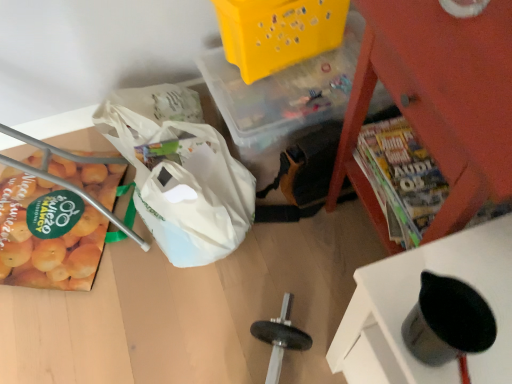
The height and width of the screenshot is (384, 512). Describe the element at coordinates (45, 239) in the screenshot. I see `yellow matte oranges at left` at that location.

Find the location of a particular element. The image size is (512, 384). silver metallic cup at lower right, arranged as the 1th furniture when viewed from the front is located at coordinates (416, 301).

Identify the location of yellow plastic basket at upper center. The width and height of the screenshot is (512, 384). (278, 32).

Find the location of `metallic red magazine rack at upper right, the second furniture positioned from the front`. metallic red magazine rack at upper right, the second furniture positioned from the front is located at coordinates (437, 102).

Who is more distant, silver metallic cup at lower right, arranged as the 1th furniture when viewed from the front, or yellow matte oranges at left?

yellow matte oranges at left is more distant.

From the image's perspective, is silver metallic cup at lower right, the second furniture viewed from the back, beneath yellow matte oranges at left?

Indeed, from the image's perspective, silver metallic cup at lower right, the second furniture viewed from the back, is shown beneath yellow matte oranges at left.

Does silver metallic cup at lower right, arranged as the 1th furniture when viewed from the front, appear on the right side of yellow matte oranges at left?

Indeed, silver metallic cup at lower right, arranged as the 1th furniture when viewed from the front, is positioned on the right side of yellow matte oranges at left.

Who is bigger, silver metallic cup at lower right, arranged as the 1th furniture when viewed from the front, or yellow matte oranges at left?

With larger size is yellow matte oranges at left.

Which of these two, silver metallic cup at lower right, the second furniture viewed from the back, or yellow plastic basket at upper center, is wider?

yellow plastic basket at upper center is wider.

Considering the sizes of silver metallic cup at lower right, the second furniture viewed from the back, and yellow plastic basket at upper center in the image, is silver metallic cup at lower right, the second furniture viewed from the back, bigger or smaller than yellow plastic basket at upper center?

In the image, silver metallic cup at lower right, the second furniture viewed from the back, appears to be smaller than yellow plastic basket at upper center.

From a real-world perspective, who is located lower, silver metallic cup at lower right, arranged as the 1th furniture when viewed from the front, or yellow plastic basket at upper center?

yellow plastic basket at upper center, from a real-world perspective.

Considering the positions of objects silver metallic cup at lower right, arranged as the 1th furniture when viewed from the front, and yellow plastic basket at upper center in the image provided, who is more to the left, silver metallic cup at lower right, arranged as the 1th furniture when viewed from the front, or yellow plastic basket at upper center?

yellow plastic basket at upper center is more to the left.

Is metallic red magazine rack at upper right, arranged as the first furniture when viewed from the back, at the back of yellow matte oranges at left?

No, metallic red magazine rack at upper right, arranged as the first furniture when viewed from the back, is not at the back of yellow matte oranges at left.

Is yellow matte oranges at left positioned before metallic red magazine rack at upper right, arranged as the first furniture when viewed from the back?

No, it is behind metallic red magazine rack at upper right, arranged as the first furniture when viewed from the back.

Is metallic red magazine rack at upper right, arranged as the first furniture when viewed from the back, completely or partially inside yellow matte oranges at left?

That's incorrect, metallic red magazine rack at upper right, arranged as the first furniture when viewed from the back, is not inside yellow matte oranges at left.

From a real-world perspective, relative to metallic red magazine rack at upper right, the second furniture positioned from the front, is yellow matte oranges at left vertically above or below?

From a real-world perspective, yellow matte oranges at left is physically below metallic red magazine rack at upper right, the second furniture positioned from the front.

In the scene shown: Considering the relative sizes of yellow plastic basket at upper center and white plastic grocery bag at lower left in the image provided, is yellow plastic basket at upper center thinner than white plastic grocery bag at lower left?

Indeed, yellow plastic basket at upper center has a lesser width compared to white plastic grocery bag at lower left.

Is point (281, 19) farther from viewer compared to point (249, 192)?

No, (281, 19) is closer to viewer.

Are yellow plastic basket at upper center and white plastic grocery bag at lower left beside each other?

No, yellow plastic basket at upper center is not beside white plastic grocery bag at lower left.

Is white plastic grocery bag at lower left oriented away from metallic red magazine rack at upper right, arranged as the first furniture when viewed from the back?

Yes, white plastic grocery bag at lower left is positioned with its back facing metallic red magazine rack at upper right, arranged as the first furniture when viewed from the back.

Is white plastic grocery bag at lower left wider or thinner than metallic red magazine rack at upper right, arranged as the first furniture when viewed from the back?

In the image, white plastic grocery bag at lower left appears to be wider than metallic red magazine rack at upper right, arranged as the first furniture when viewed from the back.

Would you say white plastic grocery bag at lower left is inside or outside metallic red magazine rack at upper right, the second furniture positioned from the front?

white plastic grocery bag at lower left is located beyond the bounds of metallic red magazine rack at upper right, the second furniture positioned from the front.

Is white plastic grocery bag at lower left to the left of metallic red magazine rack at upper right, the second furniture positioned from the front, from the viewer's perspective?

Indeed, white plastic grocery bag at lower left is positioned on the left side of metallic red magazine rack at upper right, the second furniture positioned from the front.

Considering the sizes of objects white plastic grocery bag at lower left and yellow plastic basket at upper center in the image provided, who is bigger, white plastic grocery bag at lower left or yellow plastic basket at upper center?

Bigger between the two is white plastic grocery bag at lower left.

Is white plastic grocery bag at lower left wider than yellow plastic basket at upper center?

Indeed, white plastic grocery bag at lower left has a greater width compared to yellow plastic basket at upper center.

Is white plastic grocery bag at lower left not within yellow plastic basket at upper center?

Yes, white plastic grocery bag at lower left is outside of yellow plastic basket at upper center.

From the image's perspective, is white plastic grocery bag at lower left below yellow plastic basket at upper center?

Correct, white plastic grocery bag at lower left appears lower than yellow plastic basket at upper center in the image.

From a real-world perspective, is metallic red magazine rack at upper right, the second furniture positioned from the front, physically below white plastic grocery bag at lower left?

No, from a real-world perspective, metallic red magazine rack at upper right, the second furniture positioned from the front, is not under white plastic grocery bag at lower left.

From the image's perspective, which one is positioned higher, metallic red magazine rack at upper right, the second furniture positioned from the front, or white plastic grocery bag at lower left?

metallic red magazine rack at upper right, the second furniture positioned from the front, appears higher in the image.

Considering the sizes of metallic red magazine rack at upper right, arranged as the first furniture when viewed from the back, and white plastic grocery bag at lower left in the image, is metallic red magazine rack at upper right, arranged as the first furniture when viewed from the back, bigger or smaller than white plastic grocery bag at lower left?

Clearly, metallic red magazine rack at upper right, arranged as the first furniture when viewed from the back, is larger in size than white plastic grocery bag at lower left.

Can you confirm if metallic red magazine rack at upper right, arranged as the first furniture when viewed from the back, is taller than white plastic grocery bag at lower left?

Indeed, metallic red magazine rack at upper right, arranged as the first furniture when viewed from the back, has a greater height compared to white plastic grocery bag at lower left.

The image size is (512, 384). In the image, there is a silver metallic cup at lower right, arranged as the 1th furniture when viewed from the front. Find the location of `vegetable below it (from a real-world perspective)`. vegetable below it (from a real-world perspective) is located at coordinates (45, 239).

The height and width of the screenshot is (384, 512). I want to click on basket behind the silver metallic cup at lower right, arranged as the 1th furniture when viewed from the front, so click(x=278, y=32).

Consider the image. From the image, which object appears to be farther from silver metallic cup at lower right, the second furniture viewed from the back, yellow plastic basket at upper center or white plastic grocery bag at lower left?

The object further to silver metallic cup at lower right, the second furniture viewed from the back, is yellow plastic basket at upper center.

When comparing their distances from yellow plastic basket at upper center, does silver metallic cup at lower right, the second furniture viewed from the back, or white plastic grocery bag at lower left seem further?

silver metallic cup at lower right, the second furniture viewed from the back.

Looking at the image, which one is located closer to silver metallic cup at lower right, arranged as the 1th furniture when viewed from the front, yellow plastic basket at upper center or metallic red magazine rack at upper right, arranged as the first furniture when viewed from the back?

A: metallic red magazine rack at upper right, arranged as the first furniture when viewed from the back.

Estimate the real-world distances between objects in this image. Which object is further from yellow plastic basket at upper center, yellow matte oranges at left or silver metallic cup at lower right, the second furniture viewed from the back?

Based on the image, silver metallic cup at lower right, the second furniture viewed from the back, appears to be further to yellow plastic basket at upper center.

Which object lies further to the anchor point metallic red magazine rack at upper right, the second furniture positioned from the front, white plastic grocery bag at lower left or yellow matte oranges at left?

yellow matte oranges at left is further to metallic red magazine rack at upper right, the second furniture positioned from the front.

In the scene shown: Which object lies nearer to the anchor point yellow plastic basket at upper center, white plastic grocery bag at lower left or yellow matte oranges at left?

white plastic grocery bag at lower left lies closer to yellow plastic basket at upper center than the other object.

Based on their spatial positions, is silver metallic cup at lower right, arranged as the 1th furniture when viewed from the front, or yellow matte oranges at left closer to white plastic grocery bag at lower left?

Based on the image, yellow matte oranges at left appears to be nearer to white plastic grocery bag at lower left.

From the image, which object appears to be farther from yellow matte oranges at left, yellow plastic basket at upper center or white plastic grocery bag at lower left?

The object further to yellow matte oranges at left is yellow plastic basket at upper center.

Find the location of `basket situated between white plastic grocery bag at lower left and metallic red magazine rack at upper right, the second furniture positioned from the front, from left to right`. basket situated between white plastic grocery bag at lower left and metallic red magazine rack at upper right, the second furniture positioned from the front, from left to right is located at coordinates (278, 32).

Find the location of a particular element. The height and width of the screenshot is (384, 512). basket between yellow matte oranges at left and metallic red magazine rack at upper right, the second furniture positioned from the front is located at coordinates (278, 32).

Image resolution: width=512 pixels, height=384 pixels. Find the location of `grocery bag situated between yellow matte oranges at left and yellow plastic basket at upper center from left to right`. grocery bag situated between yellow matte oranges at left and yellow plastic basket at upper center from left to right is located at coordinates (182, 181).

Locate an element on the screen. The image size is (512, 384). furniture between yellow plastic basket at upper center and silver metallic cup at lower right, arranged as the 1th furniture when viewed from the front, vertically is located at coordinates (437, 102).